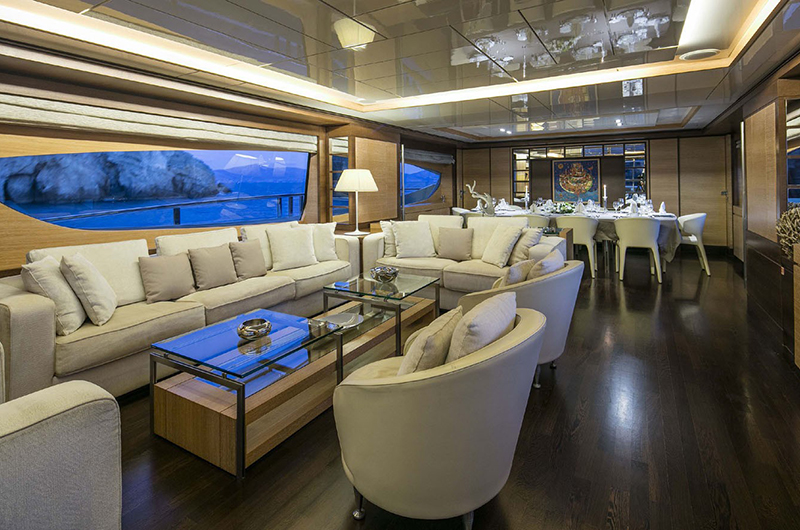
You are a GUI agent. You are given a task and a screenshot of the screen. Output one action in this format:
    pyautogui.click(x=<x>, y=<y>)
    Task: Click on the wood floor
    The image size is (800, 530).
    Given the screenshot: What is the action you would take?
    pyautogui.click(x=646, y=369)